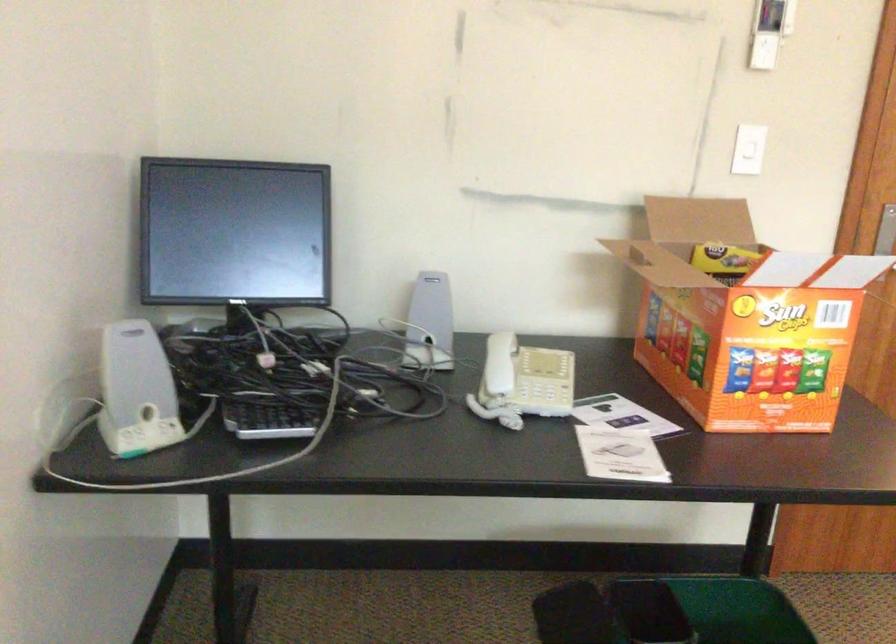
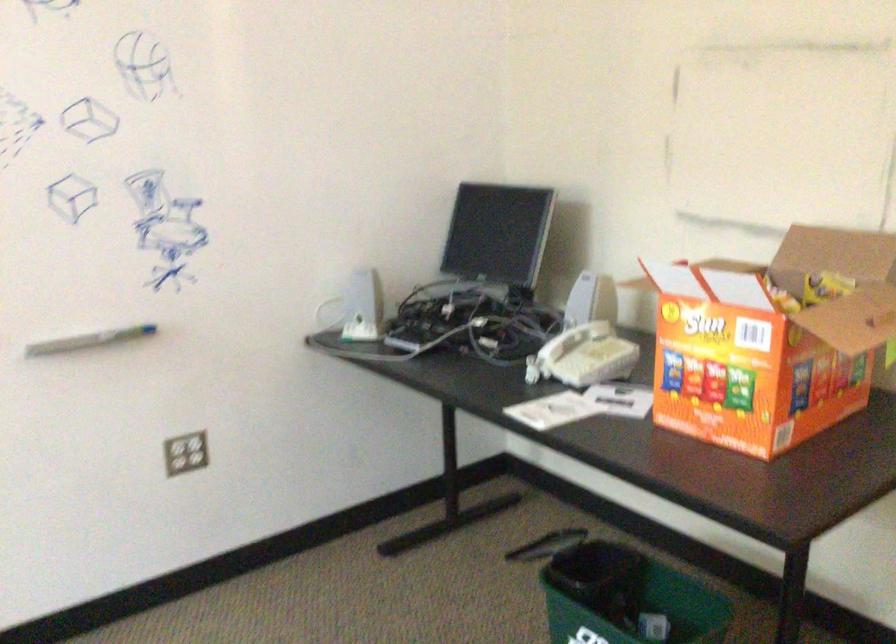
Find the pixel in the second image that matches (133,393) in the first image.

(355, 308)